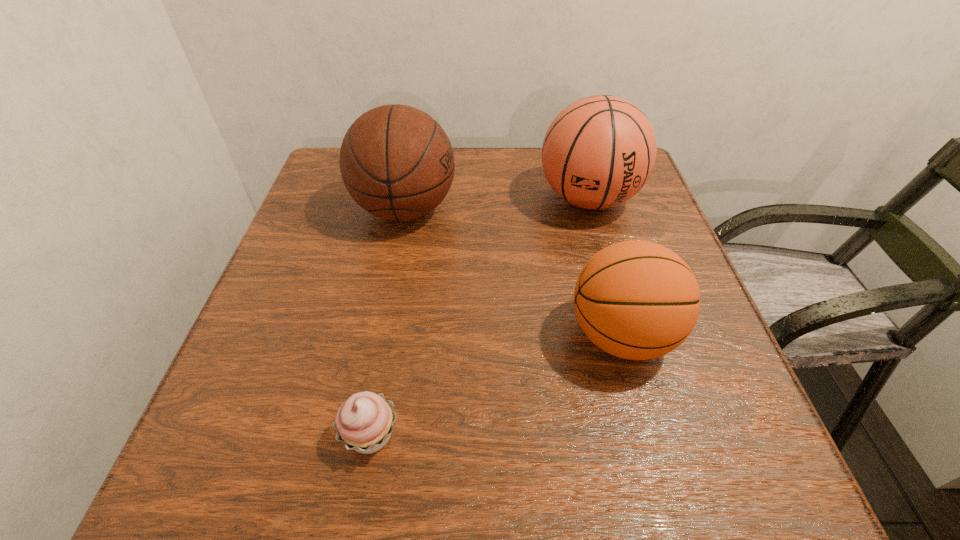
The height and width of the screenshot is (540, 960). What are the coordinates of `object that is positioned at the far left corner` in the screenshot? It's located at (397, 163).

Locate an element on the screen. The width and height of the screenshot is (960, 540). object located in the far right corner section of the desktop is located at coordinates (599, 151).

Locate an element on the screen. This screenshot has height=540, width=960. free space at the far edge of the desktop is located at coordinates (461, 156).

Image resolution: width=960 pixels, height=540 pixels. I want to click on vacant space at the left edge of the desktop, so click(x=312, y=288).

Identify the location of vacant region at the right edge of the desktop. This screenshot has height=540, width=960. (x=632, y=220).

Where is `free space at the near right corner of the desktop`? free space at the near right corner of the desktop is located at coordinates (738, 448).

Where is `vacant space that is in between the cupcake and the leftmost basketball`? vacant space that is in between the cupcake and the leftmost basketball is located at coordinates (388, 322).

You are a GUI agent. You are given a task and a screenshot of the screen. Output one action in this format:
    pyautogui.click(x=<x>, y=<y>)
    Task: Click on the blank region between the second nearest object and the leftmost basketball
    This screenshot has width=960, height=540.
    Given the screenshot: What is the action you would take?
    pyautogui.click(x=514, y=272)

Locate an element on the screen. This screenshot has height=540, width=960. vacant space in between the leftmost basketball and the shortest object is located at coordinates (388, 322).

This screenshot has height=540, width=960. What are the coordinates of `vacant space that is in between the shortest basketball and the cupcake` in the screenshot? It's located at (495, 385).